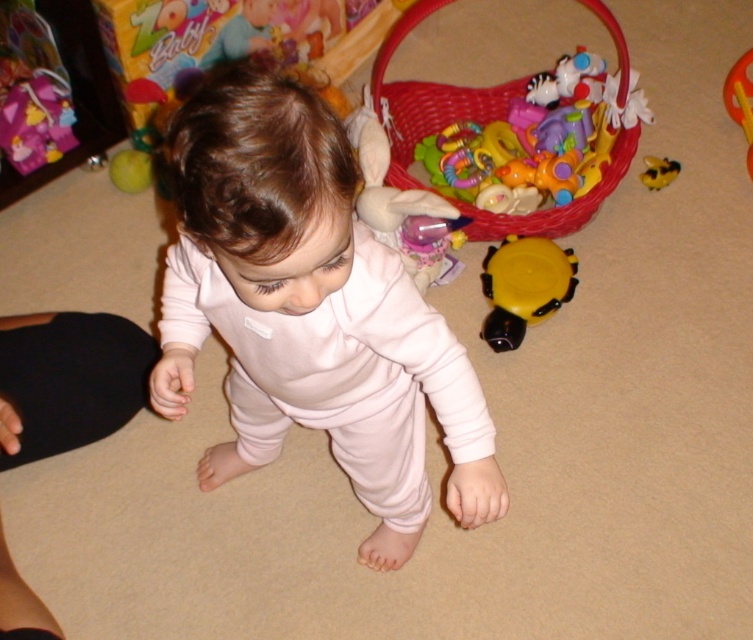
Does light pink fleece at center appear on the right side of yellow rubber bee at upper right?

No, light pink fleece at center is not to the right of yellow rubber bee at upper right.

Who is positioned more to the left, light pink fleece at center or yellow rubber bee at upper right?

light pink fleece at center

You are a GUI agent. You are given a task and a screenshot of the screen. Output one action in this format:
    pyautogui.click(x=<x>, y=<y>)
    Task: Click on the light pink fleece at center
    
    Given the screenshot: What is the action you would take?
    pyautogui.click(x=312, y=307)

Who is positioned more to the left, red wicker basket at upper center or yellow rubber duck at upper right?

red wicker basket at upper center

Find the location of `red wicker basket at upper center`. red wicker basket at upper center is located at coordinates (427, 99).

Locate an element on the screen. This screenshot has width=753, height=640. red wicker basket at upper center is located at coordinates (427, 99).

Is point (453, 116) positioned after point (645, 161)?

Yes.

From the picture: Is red wicker basket at upper center positioned before yellow rubber bee at upper right?

Yes, red wicker basket at upper center is in front of yellow rubber bee at upper right.

I want to click on red wicker basket at upper center, so click(427, 99).